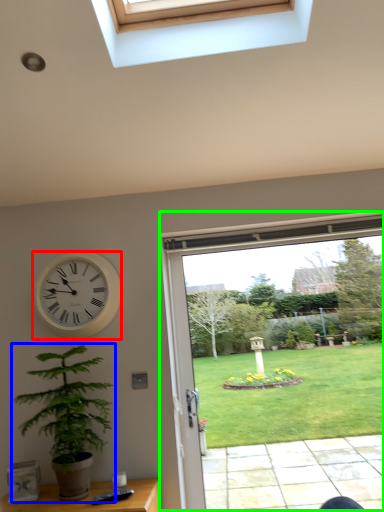
Question: Based on their relative distances, which object is farther from wall clock (highlighted by a red box)? Choose from houseplant (highlighted by a blue box) and window (highlighted by a green box).

Choices:
 (A) houseplant
 (B) window

Answer: (B)